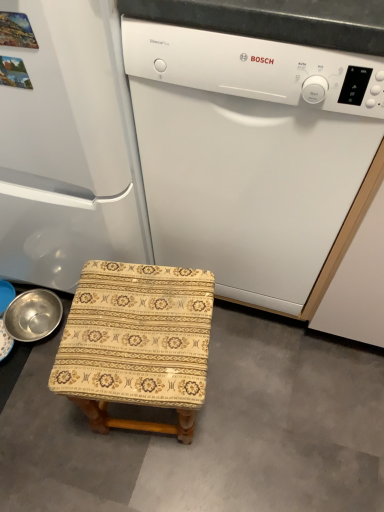
Identify the location of free space in front of metallic silver basin at lower left. (36, 385).